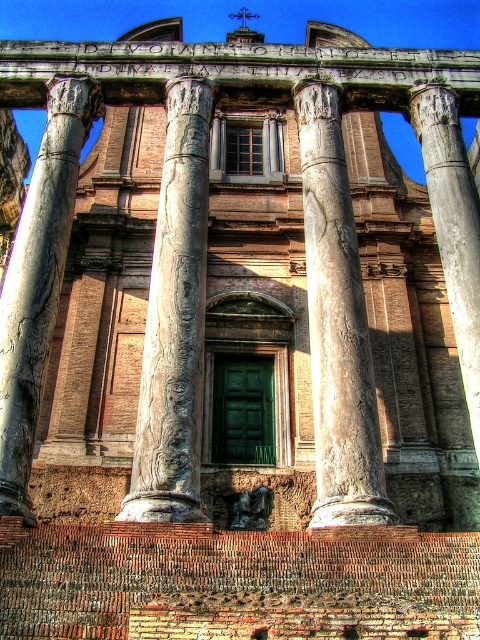
You are an architect examining the ancient Roman structure. You notice a point marked at coordinates [336,324]. Based on the scene description, what significant architectural feature is located at this point?

The point at coordinates [336,324] marks the location of the marble column at center.

You are an architect examining the ancient Roman structure. You notice two columns supporting the structure. The carved stone column at center and the smooth gray column at right. Which column is narrower in width?

The carved stone column at center is smaller than the smooth gray column at right, so the carved stone column at center is narrower in width.